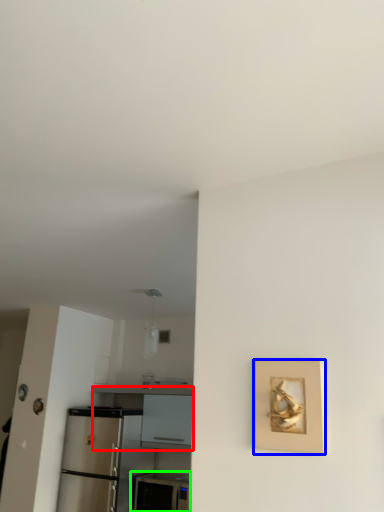
Question: Based on their relative distances, which object is nearer to counter (highlighted by a red box)? Choose from picture frame (highlighted by a blue box) and appliance (highlighted by a green box).

Choices:
 (A) picture frame
 (B) appliance

Answer: (B)